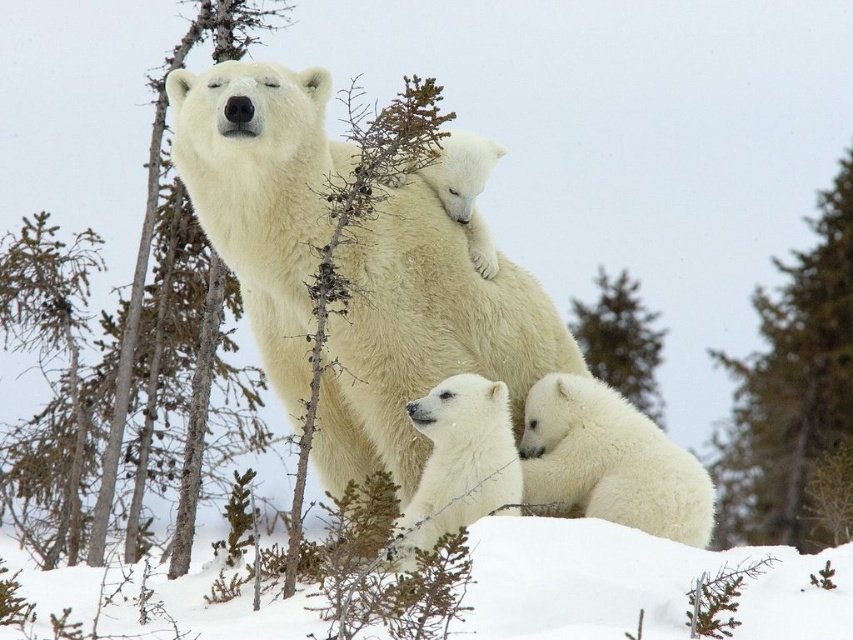
Is white fluffy snow at lower center smaller than white fluffy polar bear at lower center?

Yes, white fluffy snow at lower center is smaller than white fluffy polar bear at lower center.

Which is behind, point (675, 616) or point (488, 385)?

Point (488, 385)

Locate an element on the screen. white fluffy snow at lower center is located at coordinates (634, 584).

Can you confirm if white fluffy polar bear at center is positioned to the right of white fluffy polar bear at lower right?

Incorrect, white fluffy polar bear at center is not on the right side of white fluffy polar bear at lower right.

This screenshot has height=640, width=853. Describe the element at coordinates (421, 337) in the screenshot. I see `white fluffy polar bear at center` at that location.

Measure the distance between point [515,282] and camera.

The distance of point [515,282] from camera is 8.97 meters.

Where is `white fluffy polar bear at center`? The image size is (853, 640). white fluffy polar bear at center is located at coordinates 421,337.

Does white fluffy polar bear at lower center appear under green fuzzy tree at center?

Indeed, white fluffy polar bear at lower center is positioned under green fuzzy tree at center.

Between white fluffy polar bear at lower center and green fuzzy tree at center, which one appears on the right side from the viewer's perspective?

green fuzzy tree at center is more to the right.

Between point (498, 493) and point (648, 317), which one is positioned behind?

Point (648, 317)

Identify the location of white fluffy polar bear at lower center. The width and height of the screenshot is (853, 640). (459, 461).